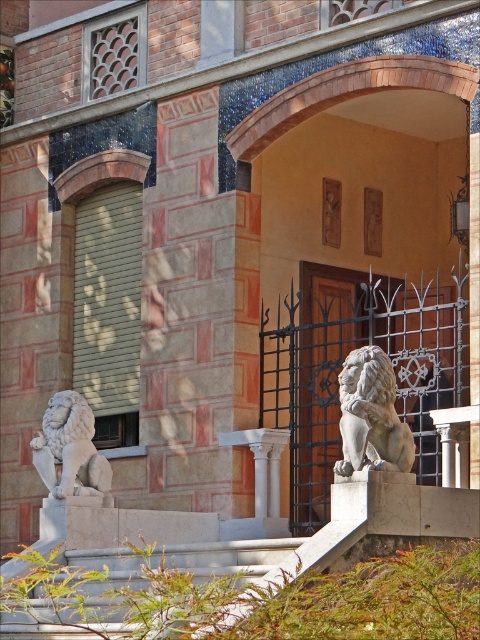
Question: Which point is closer to the camera?

Choices:
 (A) gray stone lion at center
 (B) matte stone lion at center
 (C) white marble lion at lower left

Answer: (A)

Question: Considering the real-world distances, which object is farthest from the white marble lion at lower left?

Choices:
 (A) gray stone lion at center
 (B) matte stone lion at center

Answer: (A)

Question: Can you confirm if matte stone lion at center is positioned below gray stone lion at center?

Choices:
 (A) no
 (B) yes

Answer: (A)

Question: Is gray stone lion at center wider than white marble lion at lower left?

Choices:
 (A) yes
 (B) no

Answer: (A)

Question: Where is gray stone lion at center located in relation to white marble lion at lower left in the image?

Choices:
 (A) above
 (B) below

Answer: (A)

Question: Based on their relative distances, which object is nearer to the matte stone lion at center?

Choices:
 (A) gray stone lion at center
 (B) white marble lion at lower left

Answer: (B)